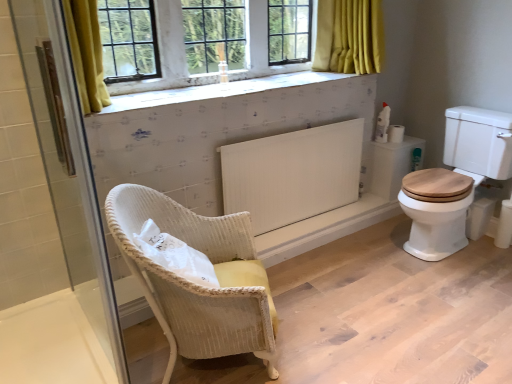
Find the location of a particular element. The image size is (512, 384). vacant point to the right of white matte toilet paper at right is located at coordinates (412, 138).